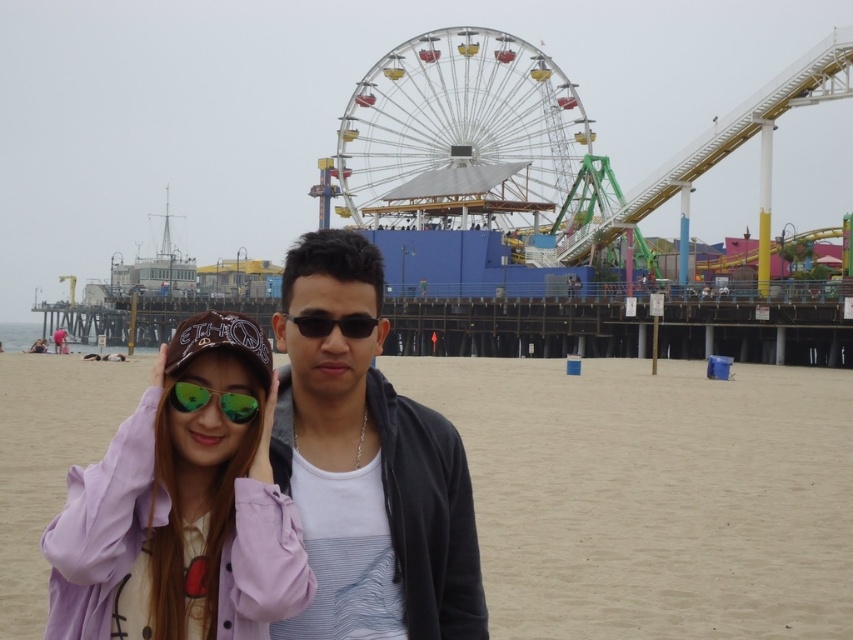
What is the 2D coordinate of the metallic ferris wheel at upper center?

The metallic ferris wheel at upper center is located at the 2D coordinate point of (x=457, y=132).

You are a photographer trying to capture the entire Ferris wheel in your shot. You notice the green reflective sunglasses at center might block your view. Based on the scene description, can you determine if the metallic ferris wheel at upper center will fit in the frame without the sunglasses blocking it?

The metallic ferris wheel at upper center is much taller than the green reflective sunglasses at center, so it should be possible to adjust the camera angle or zoom to include the entire Ferris wheel while avoiding the sunglasses at center.